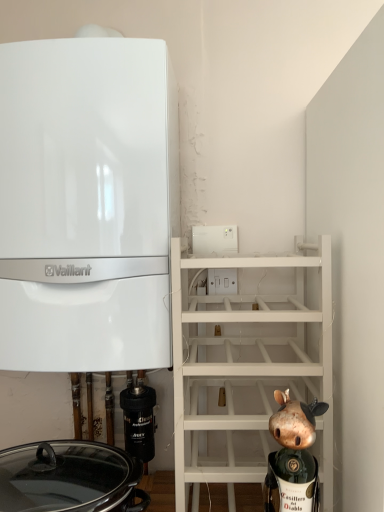
Question: Is black rubber filter at lower left facing towards gold metallic figurine at lower right?

Choices:
 (A) yes
 (B) no

Answer: (B)

Question: Considering the relative positions of black rubber filter at lower left and gold metallic figurine at lower right in the image provided, is black rubber filter at lower left in front of gold metallic figurine at lower right?

Choices:
 (A) yes
 (B) no

Answer: (B)

Question: Can you confirm if black rubber filter at lower left is shorter than gold metallic figurine at lower right?

Choices:
 (A) yes
 (B) no

Answer: (A)

Question: Is black rubber filter at lower left thinner than gold metallic figurine at lower right?

Choices:
 (A) yes
 (B) no

Answer: (A)

Question: Is black rubber filter at lower left with gold metallic figurine at lower right?

Choices:
 (A) no
 (B) yes

Answer: (A)

Question: Considering their positions, is gold metallic figurine at lower right located in front of or behind white glossy vaillant boiler at left?

Choices:
 (A) behind
 (B) front

Answer: (B)

Question: From their relative heights in the image, would you say gold metallic figurine at lower right is taller or shorter than white glossy vaillant boiler at left?

Choices:
 (A) short
 (B) tall

Answer: (A)

Question: Looking at their shapes, would you say gold metallic figurine at lower right is wider or thinner than white glossy vaillant boiler at left?

Choices:
 (A) thin
 (B) wide

Answer: (A)

Question: Is gold metallic figurine at lower right spatially inside white glossy vaillant boiler at left, or outside of it?

Choices:
 (A) inside
 (B) outside

Answer: (B)

Question: In terms of width, does black rubber filter at lower left look wider or thinner when compared to white matte shelf at upper right?

Choices:
 (A) thin
 (B) wide

Answer: (A)

Question: Considering the relative positions of black rubber filter at lower left and white matte shelf at upper right in the image provided, is black rubber filter at lower left to the left or to the right of white matte shelf at upper right?

Choices:
 (A) right
 (B) left

Answer: (B)

Question: From the image's perspective, is black rubber filter at lower left above or below white matte shelf at upper right?

Choices:
 (A) above
 (B) below

Answer: (B)

Question: Is point (144, 448) closer or farther from the camera than point (256, 279)?

Choices:
 (A) farther
 (B) closer

Answer: (B)

Question: Do you think white glossy vaillant boiler at left is within black glossy crock pot at lower left, or outside of it?

Choices:
 (A) inside
 (B) outside

Answer: (B)

Question: Considering their positions, is white glossy vaillant boiler at left located in front of or behind black glossy crock pot at lower left?

Choices:
 (A) behind
 (B) front

Answer: (A)